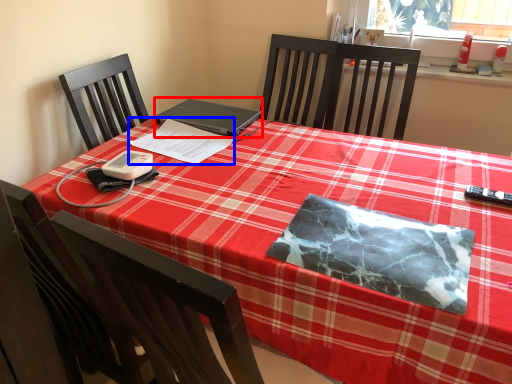
Question: Which object is further to the camera taking this photo, laptop (highlighted by a red box) or notebook (highlighted by a blue box)?

Choices:
 (A) laptop
 (B) notebook

Answer: (A)